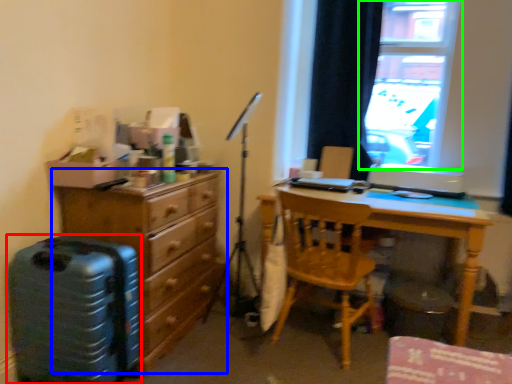
Question: Which object is the closest to the luggage (highlighted by a red box)? Choose among these: chest of drawers (highlighted by a blue box) or window (highlighted by a green box).

Choices:
 (A) chest of drawers
 (B) window

Answer: (A)